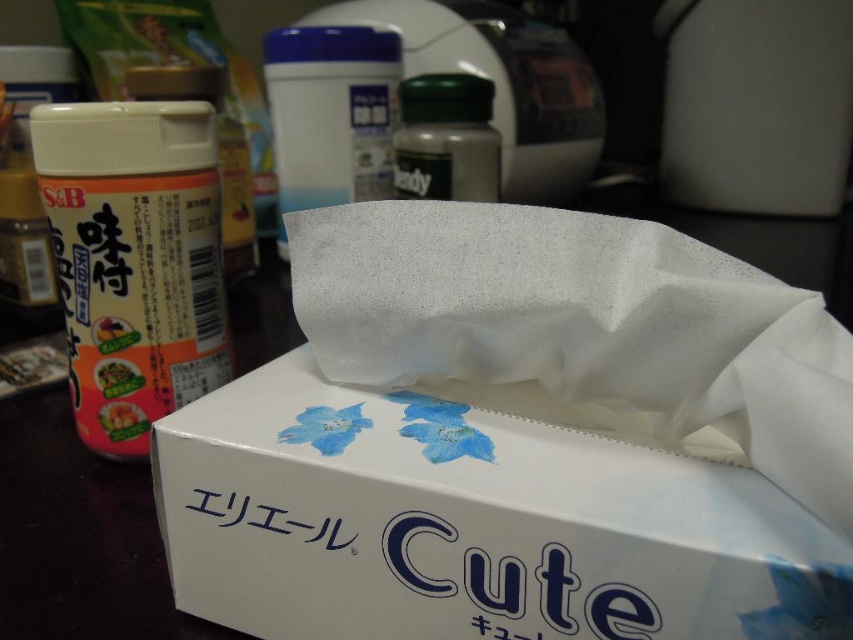
Between blue plastic container at center and green matte bottle at center, which one is positioned higher?

blue plastic container at center

Does blue plastic container at center have a lesser width compared to green matte bottle at center?

No, blue plastic container at center is not thinner than green matte bottle at center.

Is point (380, 109) closer to viewer compared to point (477, 179)?

That is False.

Where is `blue plastic container at center`? blue plastic container at center is located at coordinates (329, 115).

Who is more forward, (640, 563) or (368, 29)?

Point (640, 563) is in front.

Can you confirm if white cardboard box at center is positioned above blue plastic container at center?

No.

What are the coordinates of `white cardboard box at center` in the screenshot? It's located at (471, 524).

Locate an element on the screen. white cardboard box at center is located at coordinates (471, 524).

Between white paper tissue at center and matte plastic spice container at left, which one appears on the right side from the viewer's perspective?

white paper tissue at center is more to the right.

The width and height of the screenshot is (853, 640). In order to click on white paper tissue at center in this screenshot , I will do `click(583, 323)`.

The width and height of the screenshot is (853, 640). What are the coordinates of `white paper tissue at center` in the screenshot? It's located at (583, 323).